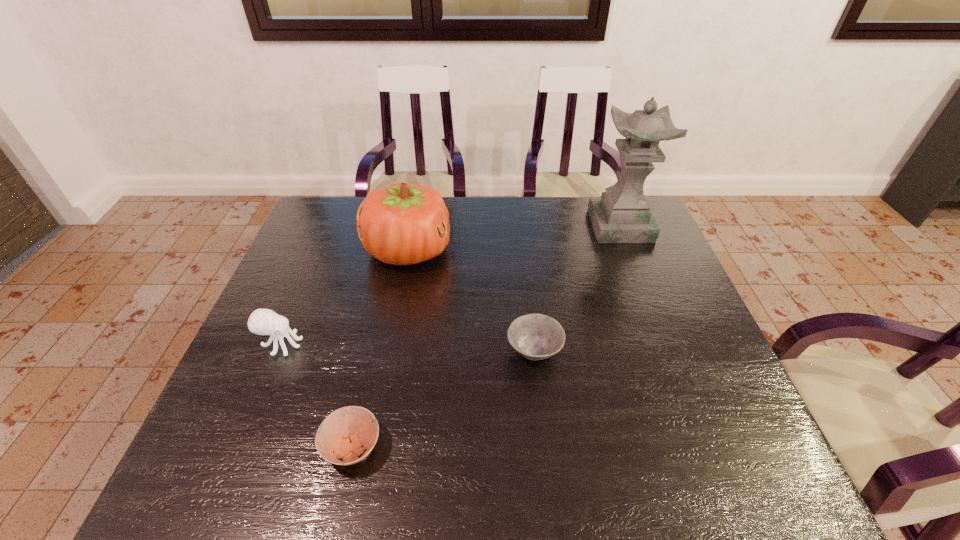
In the image, there is a desktop. At what (x,y) coordinates should I click in order to perform the action: click on vacant area at the far edge. Please return your answer as a coordinate pair (x, y). Looking at the image, I should click on (573, 231).

I want to click on vacant area at the left edge of the desktop, so click(328, 269).

Where is `vacant space at the right edge`? This screenshot has width=960, height=540. vacant space at the right edge is located at coordinates (708, 398).

You are a GUI agent. You are given a task and a screenshot of the screen. Output one action in this format:
    pyautogui.click(x=<x>, y=<y>)
    Task: Click on the free space between the rightmost object and the second tallest object
    The width and height of the screenshot is (960, 540).
    Given the screenshot: What is the action you would take?
    pyautogui.click(x=514, y=238)

Locate an element on the screen. This screenshot has height=540, width=960. free space between the rightmost object and the fourth shortest object is located at coordinates (514, 238).

Image resolution: width=960 pixels, height=540 pixels. Identify the location of free point between the sculpture and the pumpkin. (514, 238).

Find the location of a particular element. This screenshot has width=960, height=540. empty space between the shorter bowl and the fourth tallest object is located at coordinates (444, 400).

I want to click on empty location between the shorter bowl and the rightmost object, so click(486, 336).

Find the location of a particular element. The image size is (960, 540). free space that is in between the left bowl and the taller bowl is located at coordinates (444, 400).

At what (x,y) coordinates should I click in order to perform the action: click on vacant space in between the tallest object and the octopus. Please return your answer as a coordinate pair (x, y). This screenshot has width=960, height=540. Looking at the image, I should click on (451, 285).